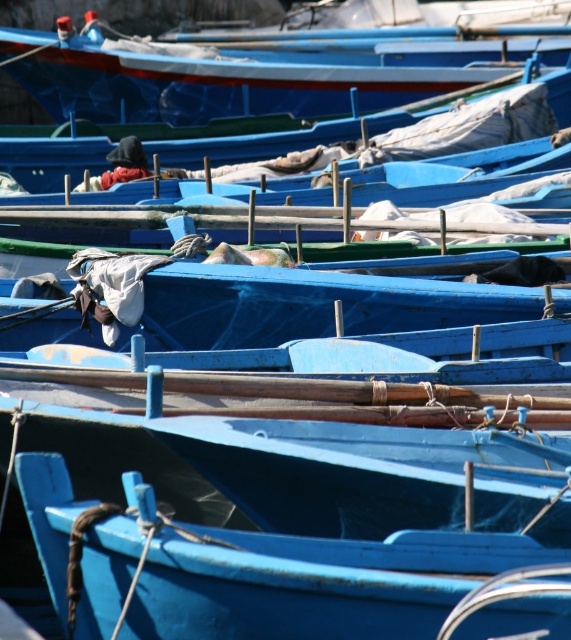
Question: Which of the following is the closest to the observer?

Choices:
 (A) (6, 42)
 (B) (520, 627)
 (C) (219, 298)

Answer: (B)

Question: Which point appears closest to the camera in this image?

Choices:
 (A) (333, 314)
 (B) (397, 547)
 (C) (170, 60)

Answer: (B)

Question: Is smooth blue boat at center thinner than blue painted wood boat at upper center?

Choices:
 (A) yes
 (B) no

Answer: (A)

Question: Which is farther from the blue painted wood boat at upper center?

Choices:
 (A) blue matte boat at center
 (B) smooth blue boat at center

Answer: (B)

Question: Does smooth blue boat at center have a smaller size compared to blue painted wood boat at upper center?

Choices:
 (A) yes
 (B) no

Answer: (A)

Question: Observing the image, what is the correct spatial positioning of blue matte boat at center in reference to blue painted wood boat at upper center?

Choices:
 (A) right
 (B) left

Answer: (A)